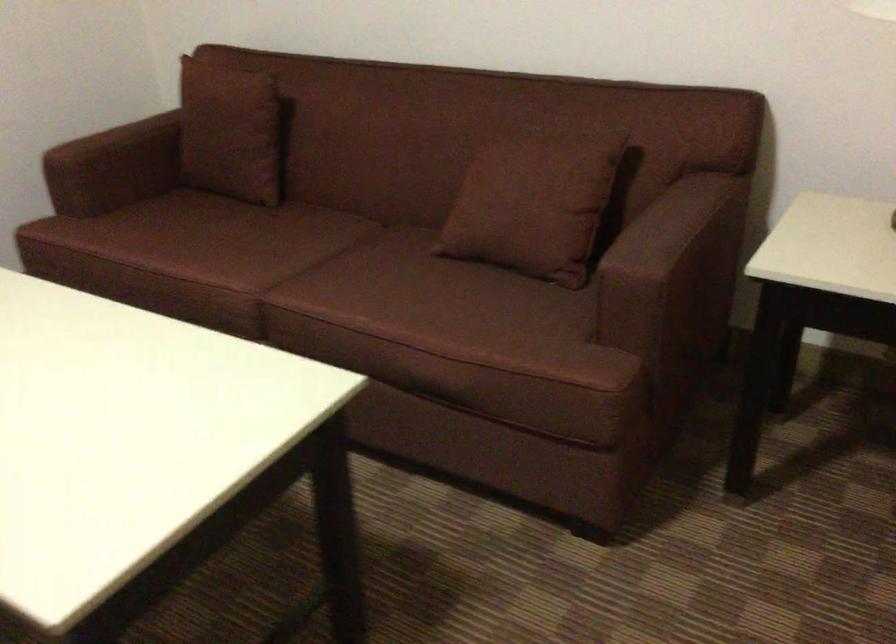
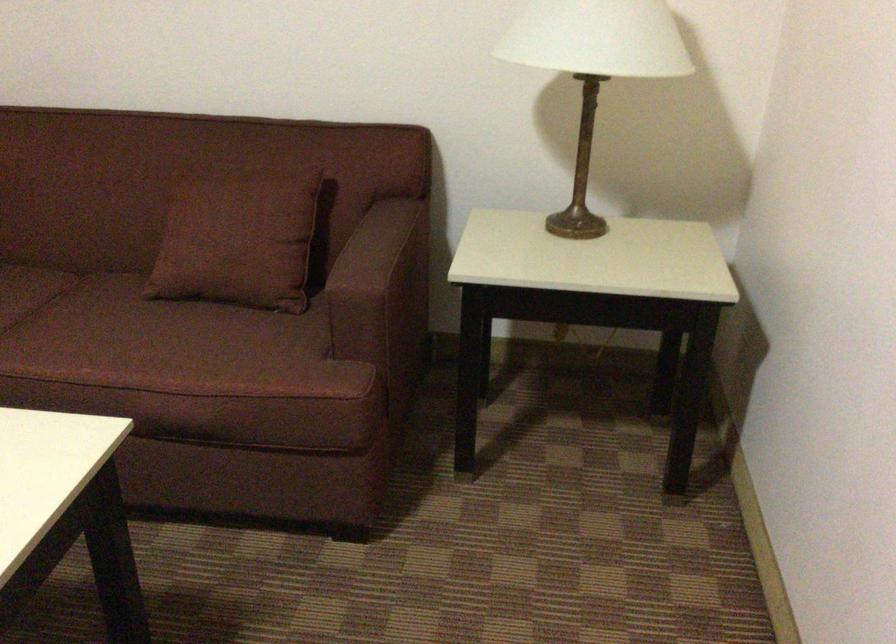
In the second image, find the point that corresponds to point (653, 232) in the first image.

(367, 254)